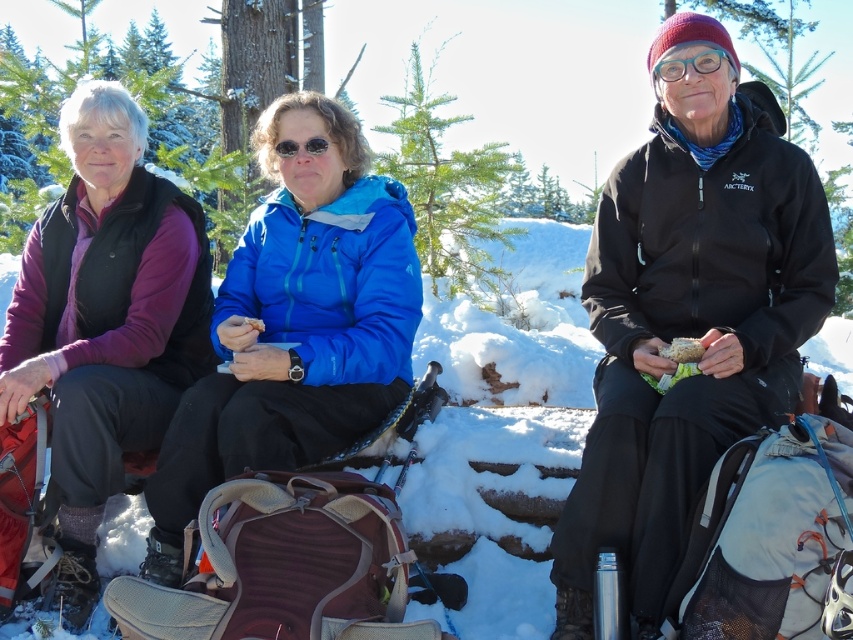
Question: Is black softshell jacket at center positioned in front of matte plastic sandwich at center?

Choices:
 (A) no
 (B) yes

Answer: (B)

Question: Is matte black jacket at center positioned behind matte plastic sandwich at center?

Choices:
 (A) no
 (B) yes

Answer: (A)

Question: Based on their relative distances, which object is nearer to the black softshell jacket at center?

Choices:
 (A) transparent blue goggles at center
 (B) matte plastic sandwich at center
 (C) white paper sandwich at center

Answer: (B)

Question: Which of the following is the closest to the observer?

Choices:
 (A) white paper sandwich at center
 (B) matte black jacket at center
 (C) transparent blue goggles at center
 (D) black softshell jacket at center

Answer: (D)

Question: Does black softshell jacket at center appear on the left side of white paper sandwich at center?

Choices:
 (A) yes
 (B) no

Answer: (B)

Question: Which point appears closest to the camera in this image?

Choices:
 (A) (157, 492)
 (B) (697, 346)
 (C) (259, 324)

Answer: (B)